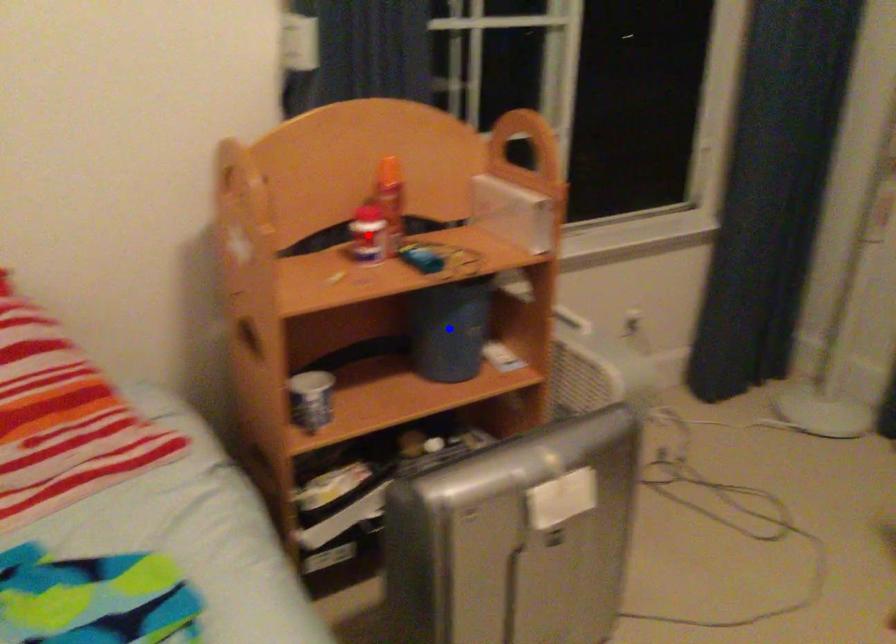
Question: Two points are marked on the image. Which point is closer to the camera?

Choices:
 (A) Blue point is closer.
 (B) Red point is closer.

Answer: (B)